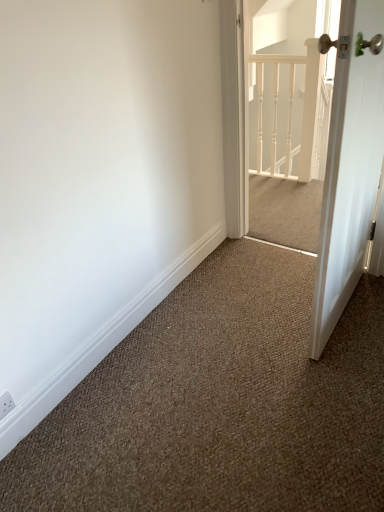
Question: Which is correct: white glossy door at right is inside white textured screen door at upper right, or outside of it?

Choices:
 (A) inside
 (B) outside

Answer: (B)

Question: In terms of height, does white glossy door at right look taller or shorter compared to white textured screen door at upper right?

Choices:
 (A) short
 (B) tall

Answer: (B)

Question: Which object is the closest to the white painted wood railing at upper center?

Choices:
 (A) white textured screen door at upper right
 (B) white glossy door at right

Answer: (A)

Question: Which is nearer to the white painted wood railing at upper center?

Choices:
 (A) white glossy door at right
 (B) white textured screen door at upper right

Answer: (B)